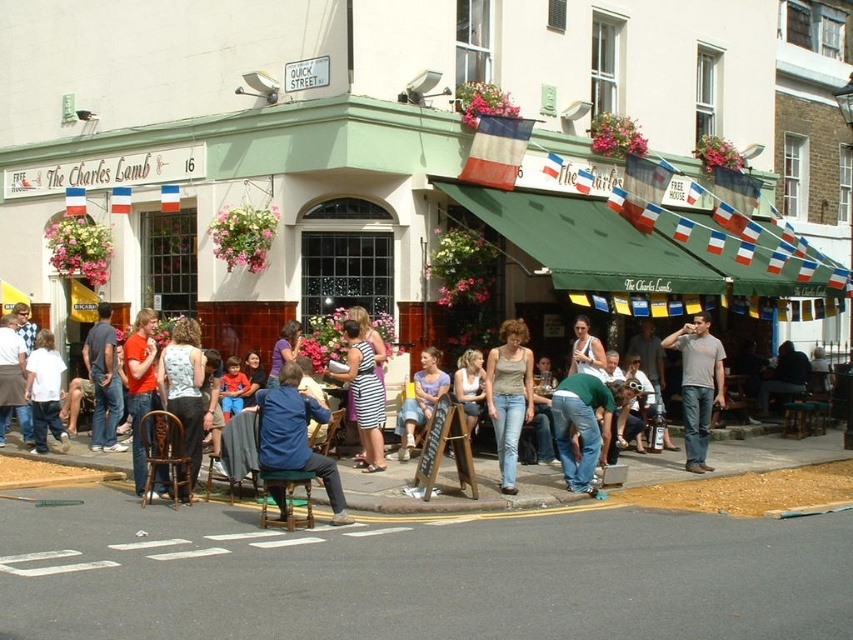
You are a photographer standing at the entrance of The Charles Lamb pub. You want to take a photo of both the white lace blouse at center and the dark blue shirt at center in the same frame. The camera you are using has a maximum focal length that allows capturing objects up to 10 meters apart. Will you be able to include both in the photo?

The white lace blouse at center and dark blue shirt at center are 11.32 meters apart, which exceeds the camera maximum focal length of 10 meters. Therefore, you cannot include both in the same frame.

You are a photographer standing in front of the pub. You want to take a photo that includes both the blue denim jacket at center and the denim jeans at center. Which object should you focus on first to ensure both are in frame?

The blue denim jacket at center is much taller than the denim jeans at center, so you should focus on the blue denim jacket at center first to ensure both are in frame.